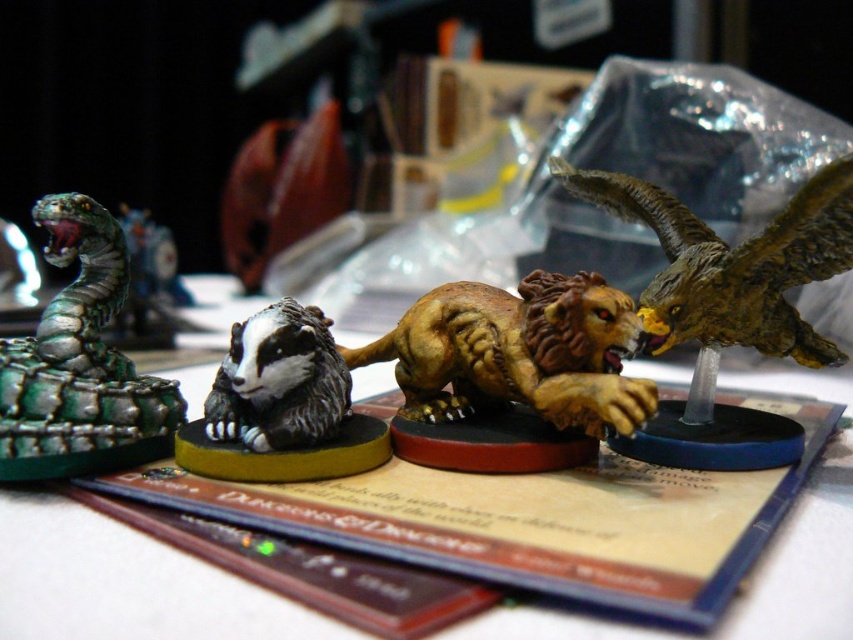
You are a game master preparing a tabletop game and need to place a new figurine exactly at the center of the table. The table has a coordinate system where the bottom left corner is point 0,0 and the top right corner is 1,1. You have a green metallic snake at left currently at point 0.569, 0.095. Where should you place the new figurine to ensure it is centered?

The center of the table would be at point (x=426, y=320). Since the green metallic snake at left is at (x=80, y=364), you should place the new figurine at (x=426, y=320) to center it on the table.

You are a player in a tabletop game and need to determine which figurine is taller to decide movement range. You see the green metallic snake at left and the shiny gold eagle at upper right. Which one is taller?

The green metallic snake at left is taller than the shiny gold eagle at upper right according to the description.

You are organizing a tabletop game and need to place a small token between the golden textured lion at center and the black matte badger at center. Considering their sizes, which figurine will the token be closer to?

The token will be closer to the golden textured lion at center because it has a larger size compared to the black matte badger at center.